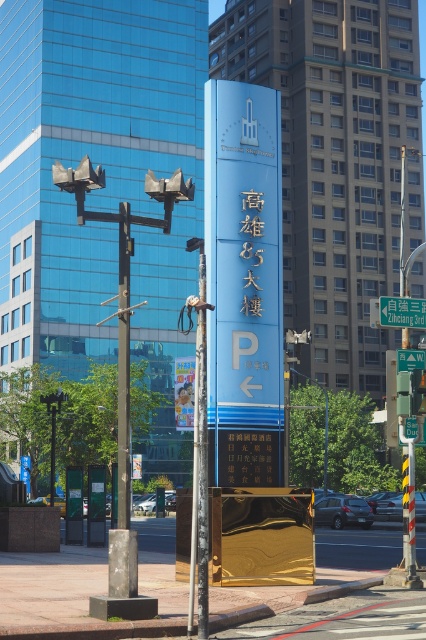
Question: Which point appears farthest from the camera in this image?

Choices:
 (A) (409, 310)
 (B) (203, 257)

Answer: (A)

Question: Does metallic pole at center have a larger size compared to blue metallic street sign at center?

Choices:
 (A) yes
 (B) no

Answer: (A)

Question: Is metallic pole at center closer to the viewer compared to blue metallic street sign at center?

Choices:
 (A) no
 (B) yes

Answer: (B)

Question: Which point is closer to the camera?

Choices:
 (A) blue metallic street sign at center
 (B) metallic pole at center

Answer: (B)

Question: Does metallic pole at center have a smaller size compared to blue metallic street sign at center?

Choices:
 (A) yes
 (B) no

Answer: (B)